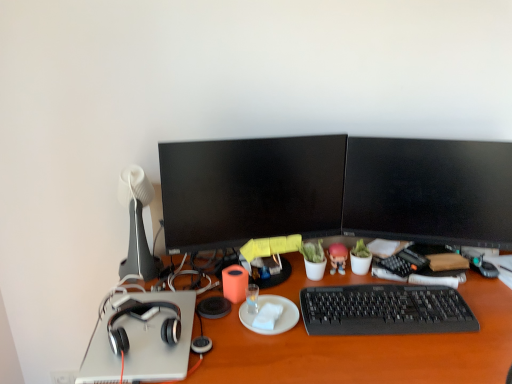
Where is `vacant space situated on the left part of white matte plate at center`? vacant space situated on the left part of white matte plate at center is located at coordinates (221, 321).